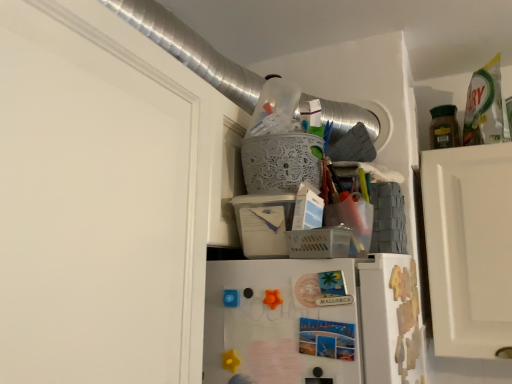
Question: Can you confirm if plastic/mesh basket at upper center, which is the first basket in bottom-to-top order, is shorter than white lace basket at upper center, which appears as the 1th basket when viewed from the top?

Choices:
 (A) yes
 (B) no

Answer: (A)

Question: Can you confirm if plastic/mesh basket at upper center, which is the first basket in bottom-to-top order, is bigger than white lace basket at upper center, which appears as the 1th basket when viewed from the top?

Choices:
 (A) yes
 (B) no

Answer: (B)

Question: Does plastic/mesh basket at upper center, which is the 2th basket from top to bottom, have a greater height compared to white lace basket at upper center, acting as the second basket starting from the bottom?

Choices:
 (A) yes
 (B) no

Answer: (B)

Question: Can you confirm if plastic/mesh basket at upper center, which is the 2th basket from top to bottom, is positioned to the right of white lace basket at upper center, which appears as the 1th basket when viewed from the top?

Choices:
 (A) no
 (B) yes

Answer: (B)

Question: From a real-world perspective, is plastic/mesh basket at upper center, which is the first basket in bottom-to-top order, beneath white lace basket at upper center, which appears as the 1th basket when viewed from the top?

Choices:
 (A) yes
 (B) no

Answer: (A)

Question: From the image's perspective, is plastic/mesh basket at upper center, which is the 2th basket from top to bottom, on top of white lace basket at upper center, which appears as the 1th basket when viewed from the top?

Choices:
 (A) no
 (B) yes

Answer: (A)

Question: Considering the relative positions of green matte jar at upper right and white lace basket at upper center, which appears as the 1th basket when viewed from the top, in the image provided, is green matte jar at upper right in front of white lace basket at upper center, which appears as the 1th basket when viewed from the top,?

Choices:
 (A) no
 (B) yes

Answer: (A)

Question: Is green matte jar at upper right not near white lace basket at upper center, which appears as the 1th basket when viewed from the top?

Choices:
 (A) yes
 (B) no

Answer: (B)

Question: Can you confirm if green matte jar at upper right is thinner than white lace basket at upper center, which appears as the 1th basket when viewed from the top?

Choices:
 (A) yes
 (B) no

Answer: (A)

Question: Does green matte jar at upper right have a smaller size compared to white lace basket at upper center, acting as the second basket starting from the bottom?

Choices:
 (A) yes
 (B) no

Answer: (A)

Question: Is green matte jar at upper right bigger than white lace basket at upper center, which appears as the 1th basket when viewed from the top?

Choices:
 (A) yes
 (B) no

Answer: (B)

Question: Is green matte jar at upper right at the left side of white lace basket at upper center, which appears as the 1th basket when viewed from the top?

Choices:
 (A) yes
 (B) no

Answer: (B)

Question: Is white lace basket at upper center, acting as the second basket starting from the bottom, oriented away from green matte jar at upper right?

Choices:
 (A) yes
 (B) no

Answer: (B)